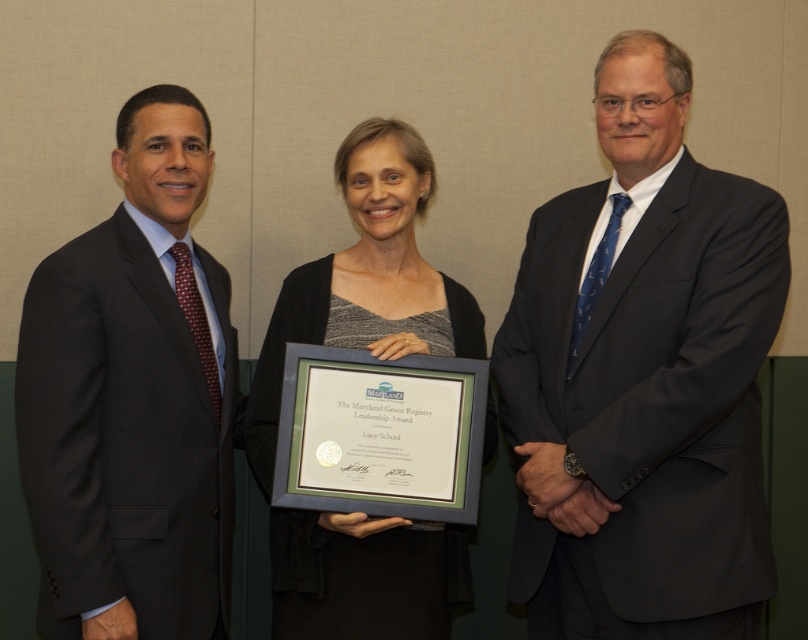
Question: From the image, what is the correct spatial relationship of dark gray pinstripe suit at left in relation to gray matte/black textured dress at center?

Choices:
 (A) below
 (B) above

Answer: (B)

Question: Which is nearer to the dark gray suit at center?

Choices:
 (A) dark gray pinstripe suit at left
 (B) gray matte/black textured dress at center

Answer: (B)

Question: Which object is farther from the camera taking this photo?

Choices:
 (A) dark gray pinstripe suit at left
 (B) dark gray suit at center
 (C) gray matte/black textured dress at center

Answer: (C)

Question: Is dark gray suit at center thinner than dark gray pinstripe suit at left?

Choices:
 (A) no
 (B) yes

Answer: (A)

Question: Which point is closer to the camera taking this photo?

Choices:
 (A) (181, 596)
 (B) (381, 144)
 (C) (537, 236)

Answer: (A)

Question: Does dark gray pinstripe suit at left appear on the left side of gray matte/black textured dress at center?

Choices:
 (A) no
 (B) yes

Answer: (B)